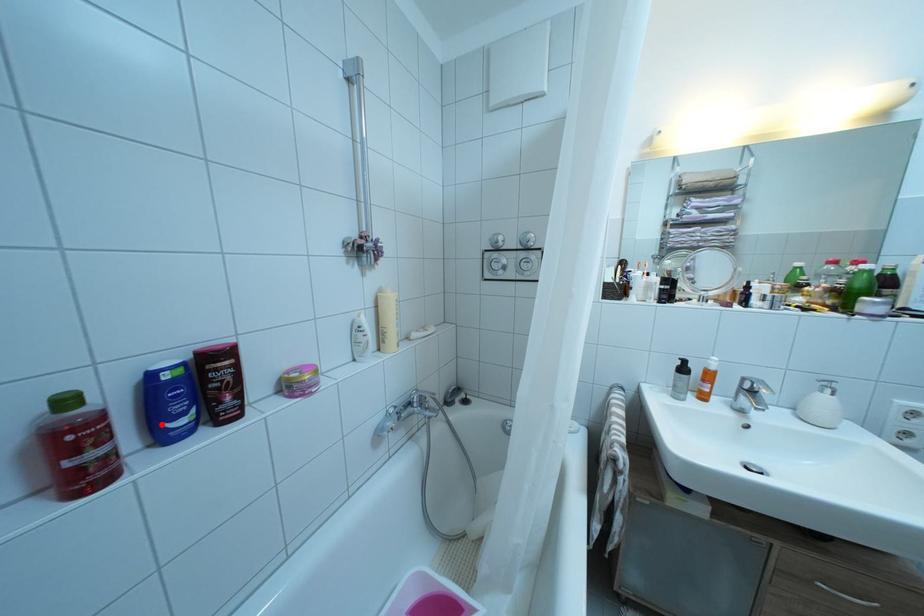
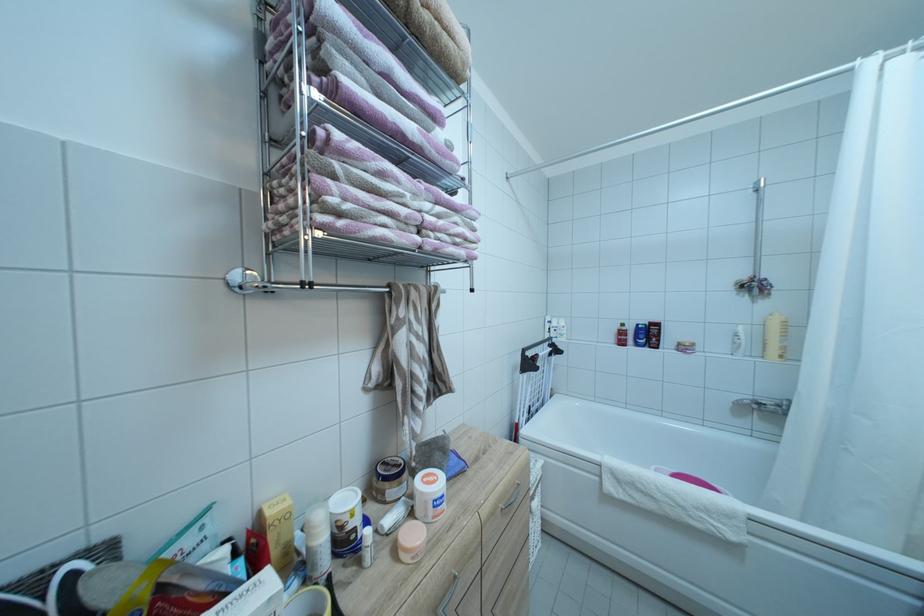
Locate, in the second image, the point that corresponds to the highlighted location in the first image.

(642, 342)